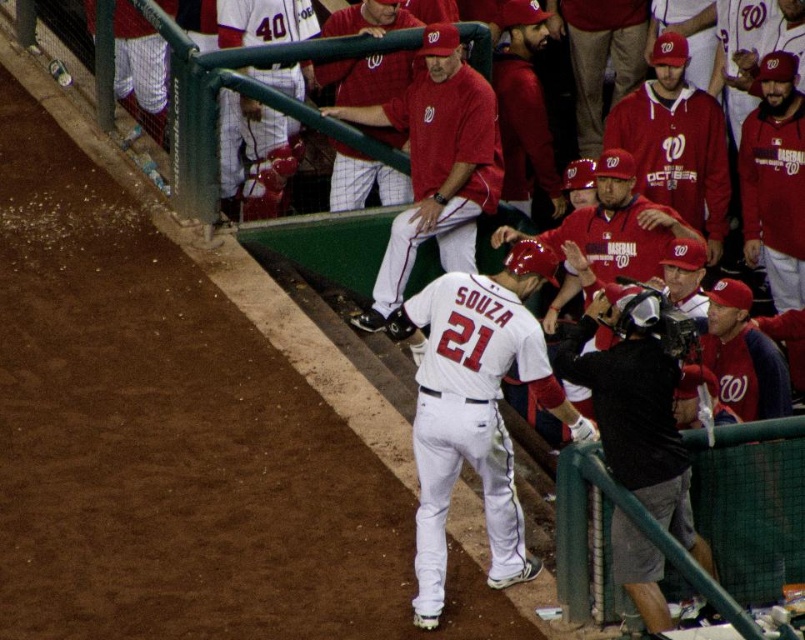
Question: Can you confirm if matte red shirt at center is positioned to the left of white jersey at upper center?

Choices:
 (A) no
 (B) yes

Answer: (A)

Question: Is matte red baseball cap at upper right below matte red cap at upper center?

Choices:
 (A) yes
 (B) no

Answer: (A)

Question: Among these objects, which one is nearest to the camera?

Choices:
 (A) black fabric camera at center
 (B) matte red cap at upper center
 (C) matte red cap at upper right
 (D) white jersey at upper center

Answer: (A)

Question: Which of the following is the closest to the observer?

Choices:
 (A) black fabric camera at center
 (B) matte red baseball cap at upper right

Answer: (A)

Question: Which point is farther to the camera?

Choices:
 (A) (548, 150)
 (B) (415, 196)
 (C) (657, 616)
 (D) (490, 518)

Answer: (A)

Question: Does matte red baseball cap at upper right have a larger size compared to white jersey at upper center?

Choices:
 (A) no
 (B) yes

Answer: (A)